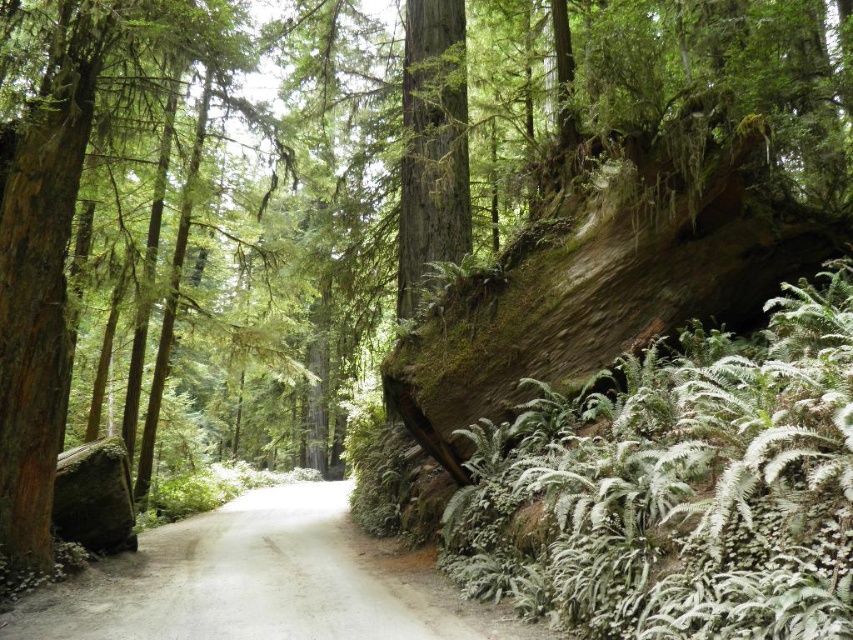
You are a hiker who wants to cross the gray concrete road at center. You are standing at point (263, 582). Is the road directly under your feet?

Yes, the gray concrete road at center is located at point (263, 582), so it is directly under your feet.

You are driving a car that is 2 meters wide. You come across a section of the gray concrete road at center where there is a smooth brown tree trunk at center blocking part of the road. Can your car pass through without going off the road?

The gray concrete road at center is bigger than the smooth brown tree trunk at center, so the car can pass through without going off the road since the road is wider than the tree trunk.